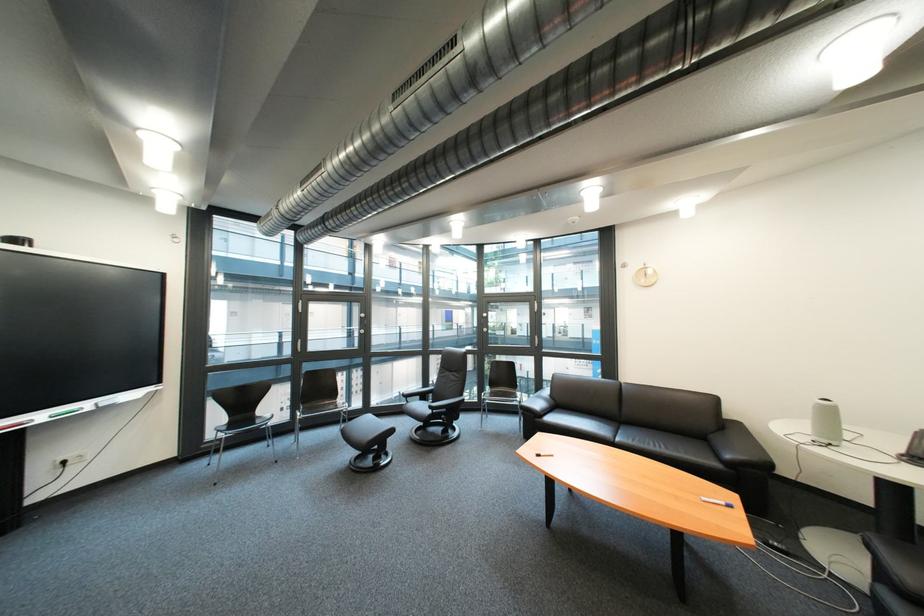
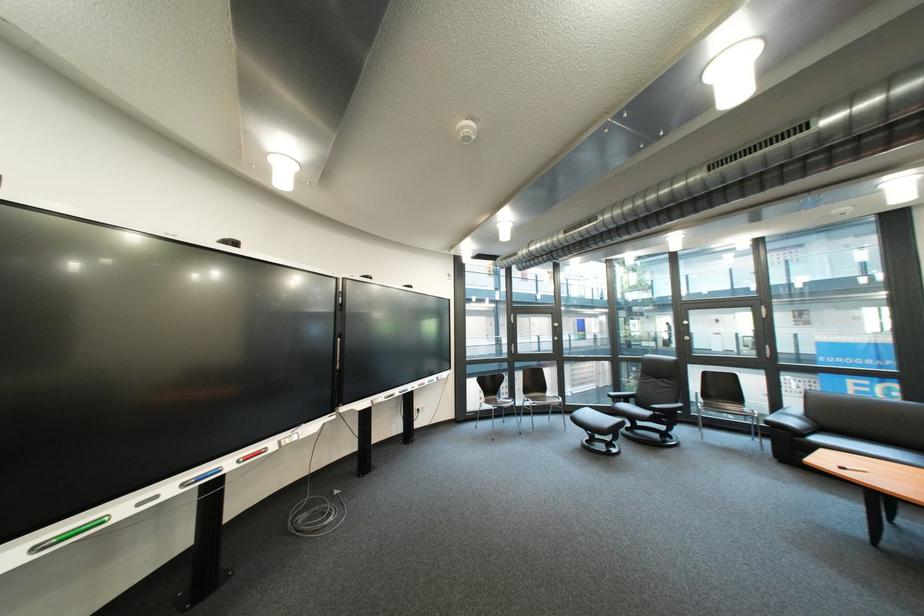
Where in the second image is the point corresponding to point 447,413 from the first image?

(670, 415)